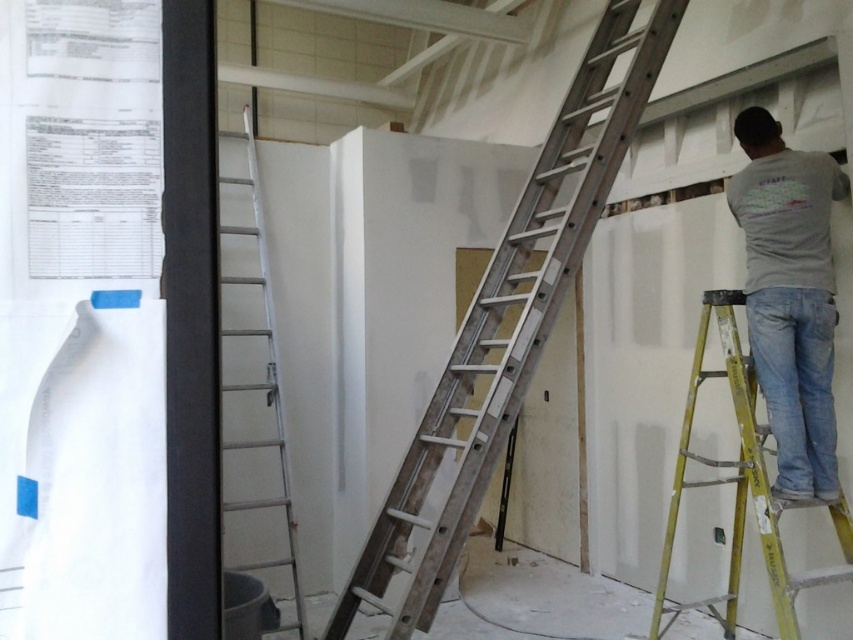
From the picture: Does metallic silver ladder at center have a greater height compared to silver metallic ladder at left?

Yes, metallic silver ladder at center is taller than silver metallic ladder at left.

Is metallic silver ladder at center closer to camera compared to silver metallic ladder at left?

Yes, it is.

Between point (647, 74) and point (245, 134), which one is positioned behind?

Positioned behind is point (245, 134).

The height and width of the screenshot is (640, 853). Identify the location of metallic silver ladder at center. (509, 321).

Between yellow/yellowish metallic ladder at right and silver metallic ladder at left, which one has more height?

silver metallic ladder at left is taller.

Is yellow/yellowish metallic ladder at right above silver metallic ladder at left?

No.

Between point (761, 524) and point (274, 339), which one is positioned behind?

The point (274, 339) is behind.

I want to click on yellow/yellowish metallic ladder at right, so click(741, 486).

Is metallic silver ladder at center above yellow/yellowish metallic ladder at right?

Yes.

Is metallic silver ladder at center positioned before yellow/yellowish metallic ladder at right?

No, it is behind yellow/yellowish metallic ladder at right.

Is point (335, 628) closer to camera compared to point (822, 500)?

No, (335, 628) is further to viewer.

Where is `metallic silver ladder at center`? The height and width of the screenshot is (640, 853). metallic silver ladder at center is located at coordinates (509, 321).